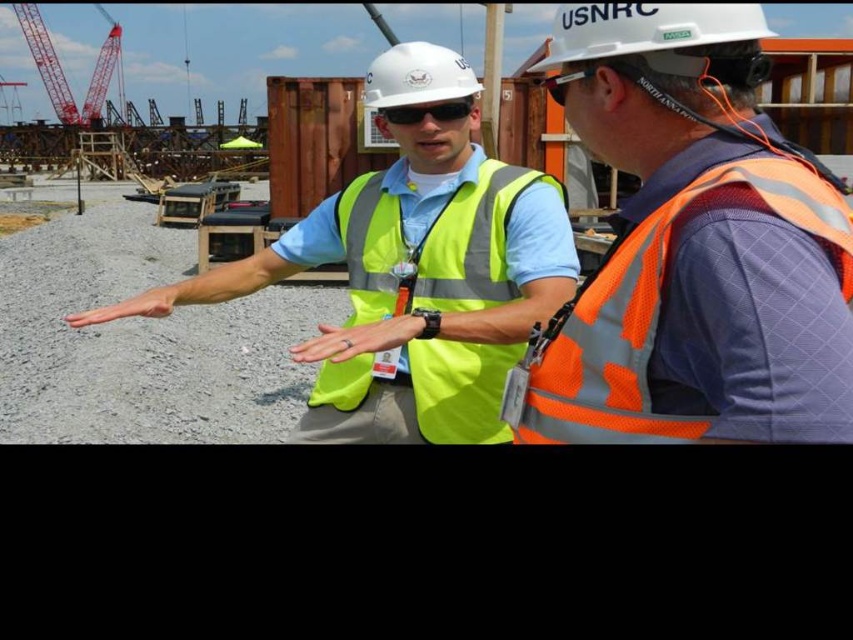
You are a safety inspector at the construction site and need to check two points for compliance. The first point is at coordinate point (422, 355) and the second point is at coordinate point (677, 17). Which point is closer to you?

Point (422, 355) is closer to you because it is further to the viewer than point (677, 17).